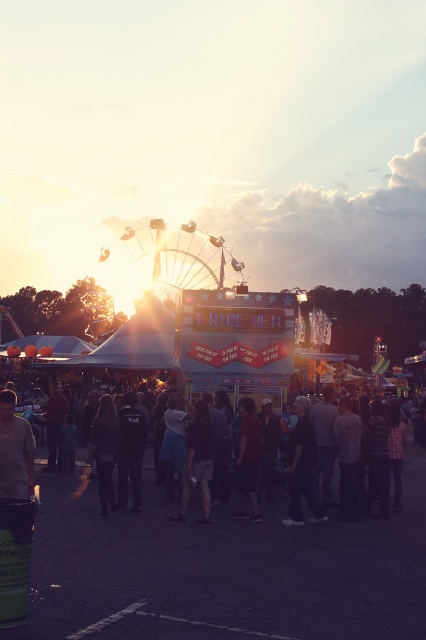
You are a person who is 5 feet tall and wants to see over the crowd at the fair. There is a dark gray casual clothing at center and a dark gray jacket at center in your way. Can you see over them if you stand between them?

The distance between the dark gray casual clothing at center and the dark gray jacket at center is 17.12 feet. Since you are only 5 feet tall, the height of the people in the crowd and the objects in between would block your view. It is unlikely you can see over them from that distance.

You are a photographer at the fair and want to take a photo of both the dark gray casual clothing at center and the dark red shirt at center. Which one should you focus on first if you want to capture them in order from left to right?

The dark gray casual clothing at center is to the left of the dark red shirt at center, so you should focus on the dark gray casual clothing at center first to capture them from left to right.